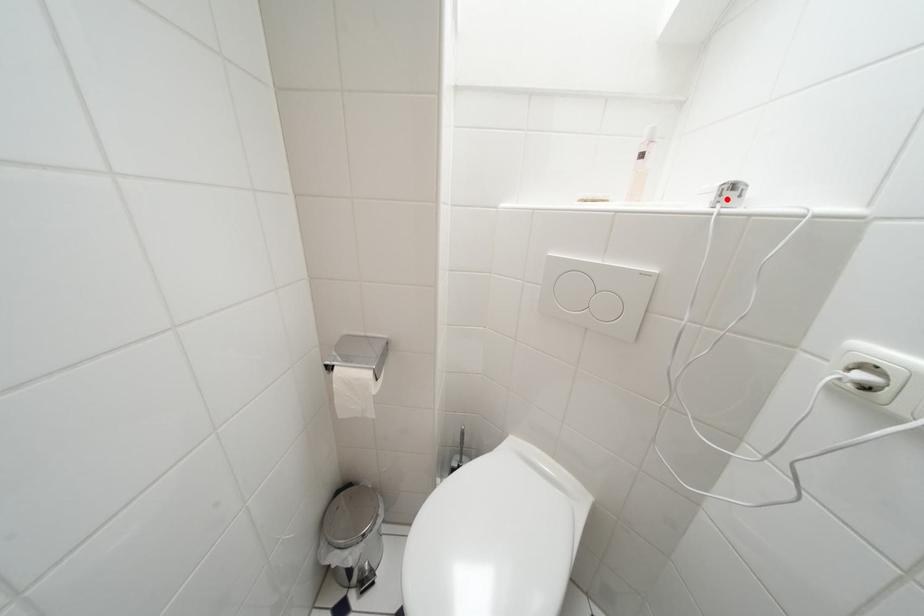
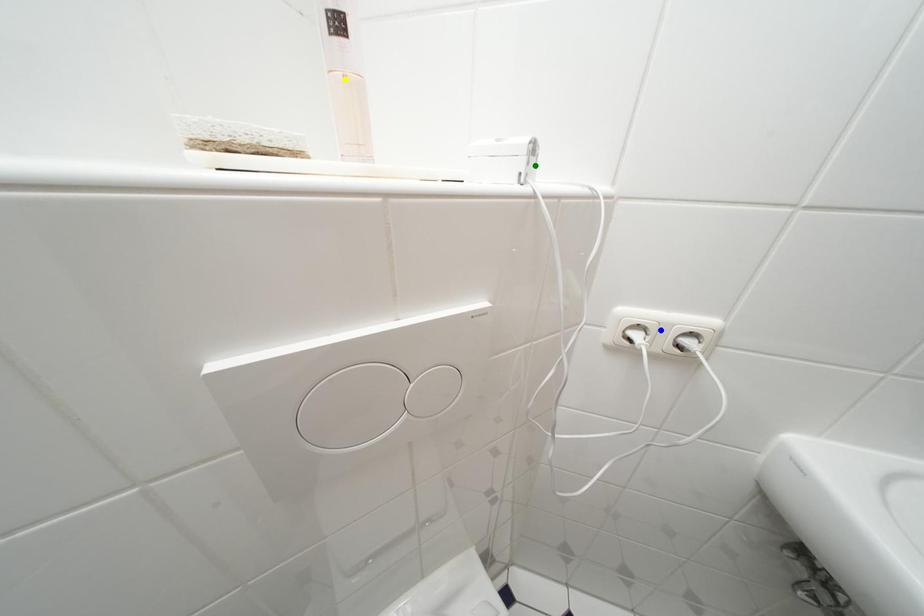
Question: I am providing you with two images of the same scene from different viewpoints. A red point is marked on the first image. You are given multiple points on the second image. Which point in image 2 is actually the same real-world point as the red point in image 1?

Choices:
 (A) yellow point
 (B) blue point
 (C) green point

Answer: (C)